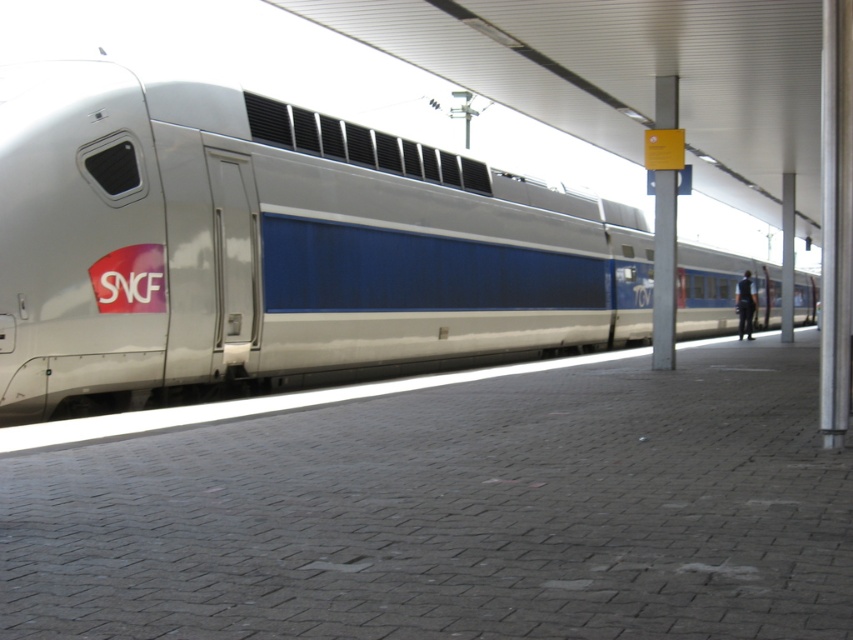
From the picture: Does white glossy train at center have a lesser width compared to black fabric person at right?

Incorrect, white glossy train at center's width is not less than black fabric person at right's.

What do you see at coordinates (271, 243) in the screenshot?
I see `white glossy train at center` at bounding box center [271, 243].

Find the location of a particular element. white glossy train at center is located at coordinates (271, 243).